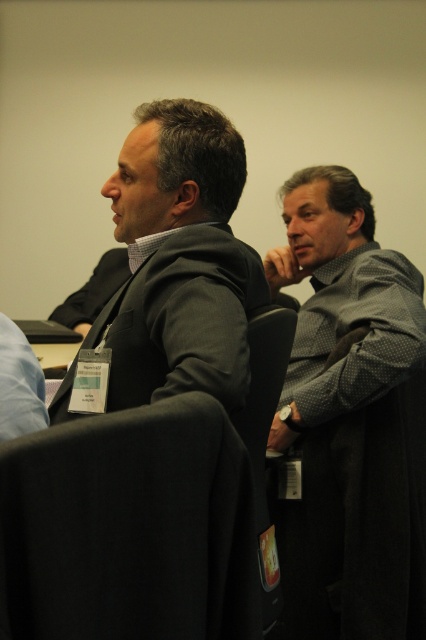
Does black fabric chair at center have a lesser height compared to gray dotted shirt at center?

Yes, black fabric chair at center is shorter than gray dotted shirt at center.

Does point (331, 522) lie in front of point (316, 212)?

Yes, point (331, 522) is in front of point (316, 212).

Identify the location of black fabric chair at center. This screenshot has width=426, height=640. (356, 524).

Is point (66, 410) closer to viewer compared to point (400, 432)?

Yes.

Which of these two, dark gray suit at center or black fabric chair at center, stands shorter?

dark gray suit at center is shorter.

Does point (221, 115) come behind point (354, 474)?

No, (221, 115) is in front of (354, 474).

You are a GUI agent. You are given a task and a screenshot of the screen. Output one action in this format:
    pyautogui.click(x=<x>, y=<y>)
    Task: Click on the dark gray suit at center
    The image size is (426, 640).
    Given the screenshot: What is the action you would take?
    [180, 260]

Is point (215, 509) more distant than point (336, 349)?

That is False.

Looking at this image, which of these two, black fabric chair at lower left or black fabric chair at center, stands taller?

black fabric chair at center is taller.

I want to click on black fabric chair at lower left, so click(x=129, y=528).

I want to click on black fabric chair at lower left, so click(129, 528).